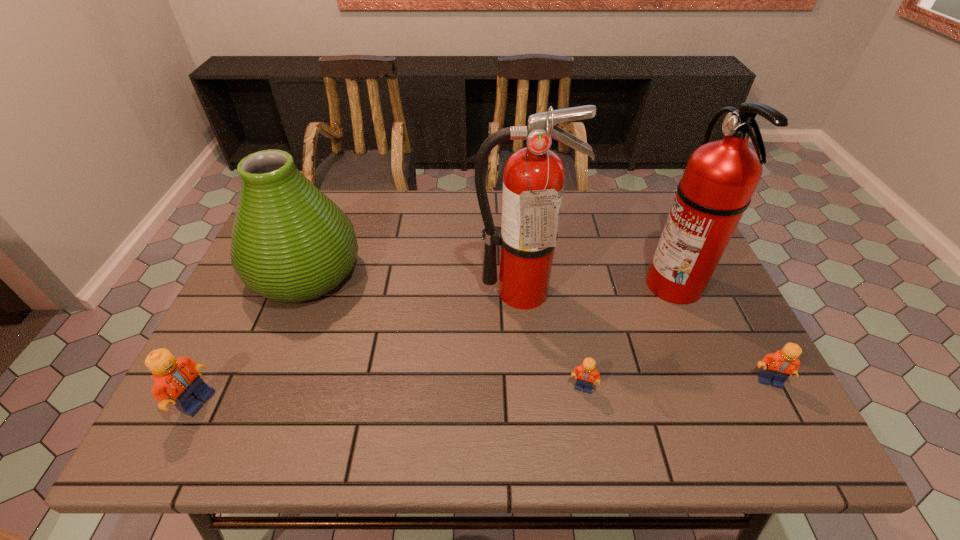
I want to click on object located at the near right corner, so click(x=777, y=367).

The width and height of the screenshot is (960, 540). What are the coordinates of `vacant region at the far edge of the desktop` in the screenshot? It's located at (609, 236).

In the image, there is a desktop. What are the coordinates of `blank space at the near edge` in the screenshot? It's located at (517, 380).

What are the coordinates of `vacant region at the left edge of the desktop` in the screenshot? It's located at (259, 330).

In the image, there is a desktop. Where is `free space at the far right corner`? This screenshot has height=540, width=960. free space at the far right corner is located at coordinates (640, 224).

You are a GUI agent. You are given a task and a screenshot of the screen. Output one action in this format:
    pyautogui.click(x=<x>, y=<y>)
    Task: Click on the vacant region between the shortest Lego and the fourth shortest object
    This screenshot has height=540, width=960.
    Given the screenshot: What is the action you would take?
    pyautogui.click(x=444, y=330)

The height and width of the screenshot is (540, 960). Identify the location of vacant area that lies between the leftmost Lego and the right fire extinguisher. (435, 342).

I want to click on unoccupied area between the right fire extinguisher and the rightmost object, so click(721, 332).

Where is `empty space that is in between the vase and the left fire extinguisher`? This screenshot has height=540, width=960. empty space that is in between the vase and the left fire extinguisher is located at coordinates (414, 282).

You are a GUI agent. You are given a task and a screenshot of the screen. Output one action in this format:
    pyautogui.click(x=<x>, y=<y>)
    Task: Click on the vacant area that lies between the left fire extinguisher and the second tallest Lego
    This screenshot has width=960, height=540.
    Given the screenshot: What is the action you would take?
    pyautogui.click(x=645, y=336)